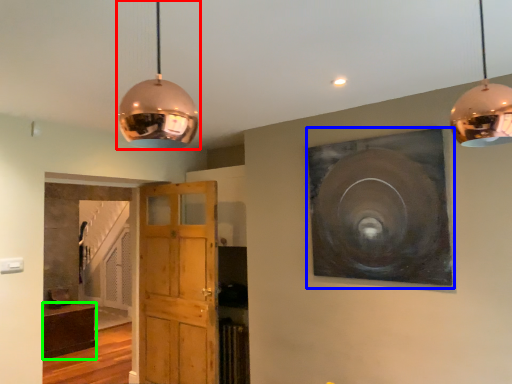
Question: Estimate the real-world distances between objects in this image. Which object is farther from lamp (highlighted by a red box), picture frame (highlighted by a blue box) or cabinetry (highlighted by a green box)?

Choices:
 (A) picture frame
 (B) cabinetry

Answer: (B)